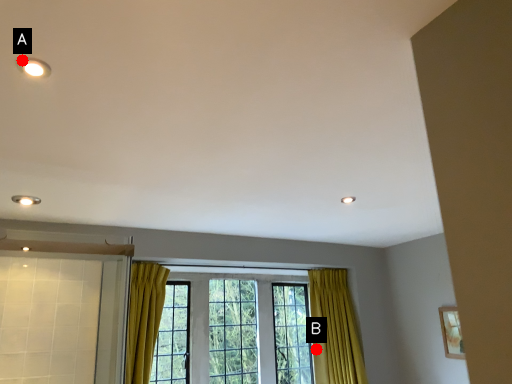
Question: Two points are circled on the image, labeled by A and B beside each circle. Which of the following is the closest to the observer?

Choices:
 (A) A is closer
 (B) B is closer

Answer: (A)